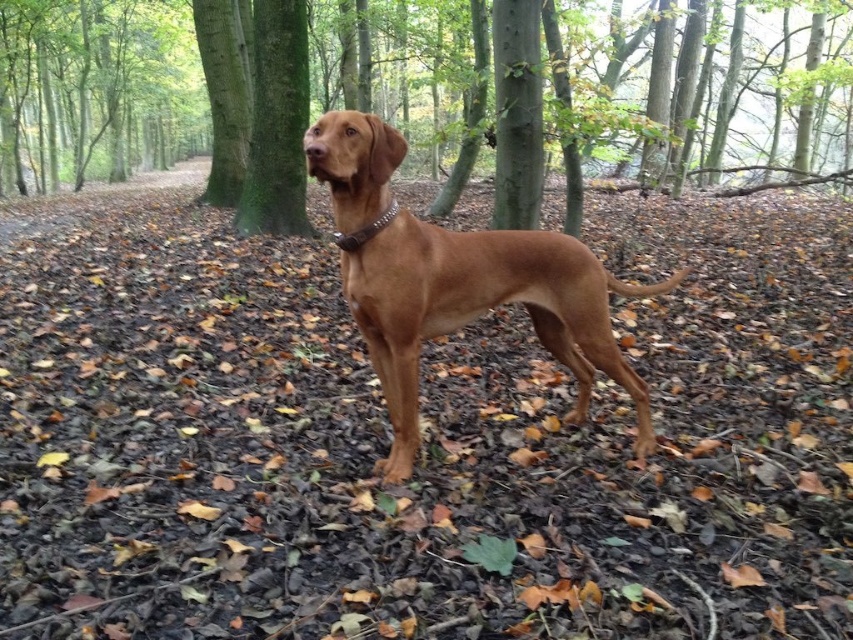
Is point (56, 152) closer to viewer compared to point (544, 276)?

No, (56, 152) is behind (544, 276).

Is brown bark tree at center wider than brown leather dog at center?

Correct, the width of brown bark tree at center exceeds that of brown leather dog at center.

Is point (270, 180) more distant than point (399, 332)?

Yes.

Locate an element on the screen. This screenshot has height=640, width=853. brown bark tree at center is located at coordinates (419, 96).

Who is positioned more to the left, brown bark tree at center or green mossy tree trunk at center?

brown bark tree at center is more to the left.

From the picture: Measure the distance between brown bark tree at center and camera.

brown bark tree at center and camera are 4.59 meters apart.

Is point (561, 60) closer to viewer compared to point (300, 61)?

Yes.

Identify the location of brown bark tree at center. coord(419,96).

Who is shorter, brown leather dog at center or green mossy tree trunk at center?

Standing shorter between the two is brown leather dog at center.

Does brown leather dog at center have a smaller size compared to green mossy tree trunk at center?

Yes, brown leather dog at center is smaller than green mossy tree trunk at center.

Between point (572, 298) and point (292, 65), which one is positioned behind?

The point (292, 65) is more distant.

I want to click on brown leather dog at center, so click(456, 282).